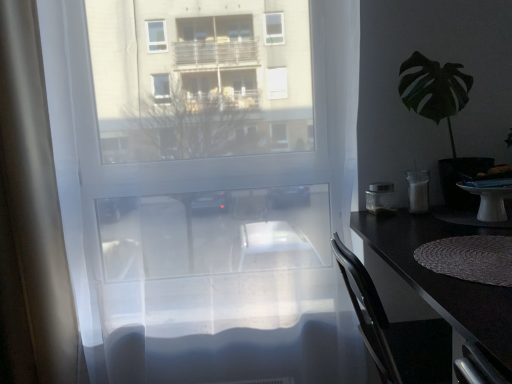
Question: Based on their sizes in the image, would you say metallic silver container at right, marked as the 1th appliance in a left-to-right arrangement, is bigger or smaller than white opaque glass at right, placed as the first appliance when sorted from right to left?

Choices:
 (A) big
 (B) small

Answer: (B)

Question: Considering the positions of point (381, 205) and point (419, 210), is point (381, 205) closer or farther from the camera than point (419, 210)?

Choices:
 (A) farther
 (B) closer

Answer: (A)

Question: Considering the real-world distances, which object is closest to the green leafy plant at right?

Choices:
 (A) white opaque glass at right, which is counted as the second appliance, starting from the left
 (B) metallic silver container at right, which is counted as the 2th appliance, starting from the right
 (C) black glossy desk at right

Answer: (A)

Question: Considering the real-world distances, which object is farthest from the white opaque glass at right, which is counted as the second appliance, starting from the left?

Choices:
 (A) metallic silver container at right, marked as the 1th appliance in a left-to-right arrangement
 (B) green leafy plant at right
 (C) black glossy desk at right

Answer: (B)